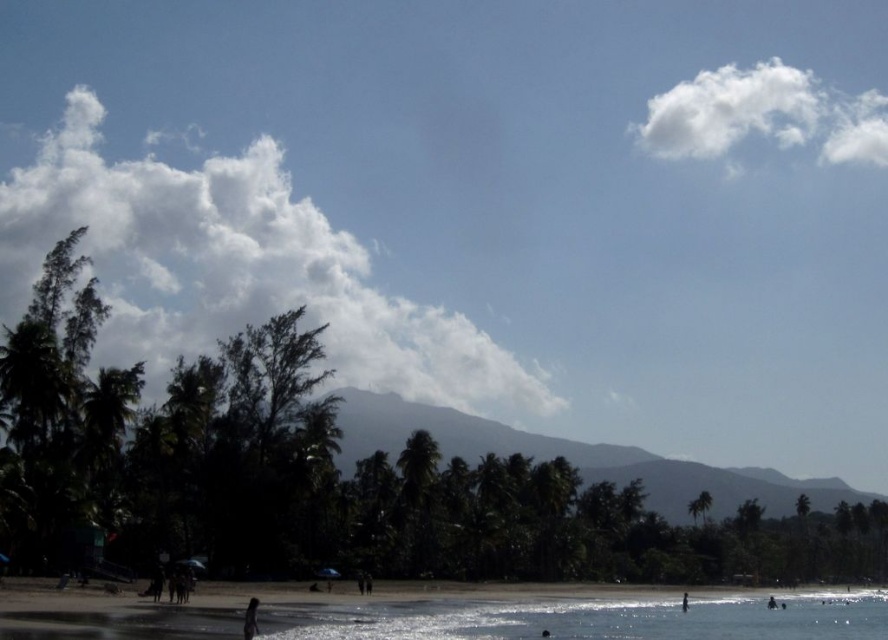
You are standing on the smooth sand beach at lower center and want to get to the dark skin human at lower center. Which direction should you move to reach them?

The smooth sand beach at lower center is in front of the dark skin human at lower center, so you should move backward to reach them.

You are standing on the beach and see the smooth sand beach at lower center and the dark skin human at lower right. Which object is positioned to the right of the other?

The smooth sand beach at lower center is to the right of the dark skin human at lower right.